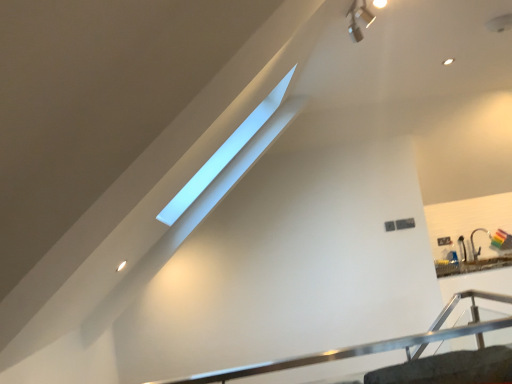
What is the approximate height of metallic silver light fixture at upper right?

The height of metallic silver light fixture at upper right is 6.63 inches.

Where is `metallic silver light fixture at upper right`? metallic silver light fixture at upper right is located at coordinates (360, 19).

This screenshot has width=512, height=384. What do you see at coordinates (360, 19) in the screenshot?
I see `metallic silver light fixture at upper right` at bounding box center [360, 19].

This screenshot has width=512, height=384. I want to click on metallic silver light fixture at upper right, so click(x=360, y=19).